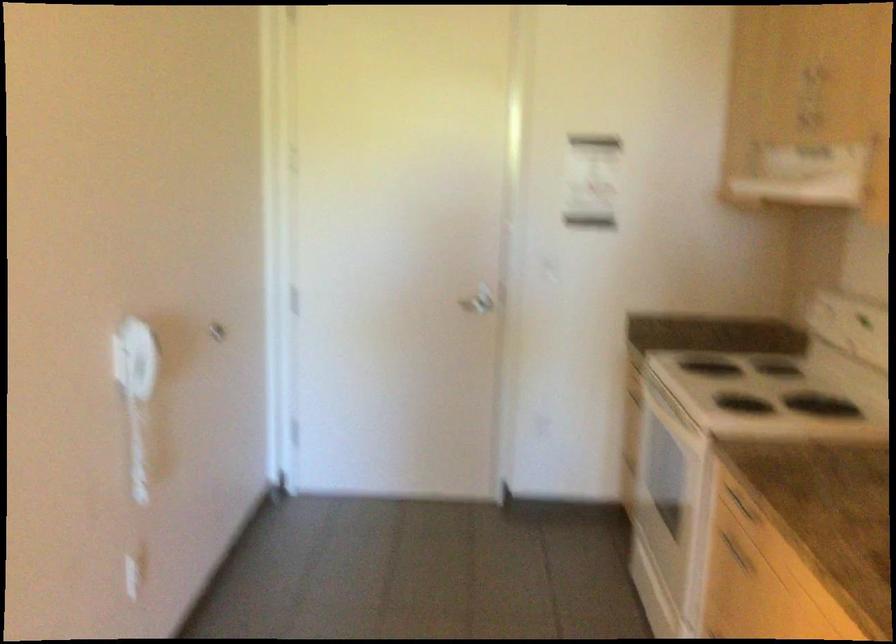
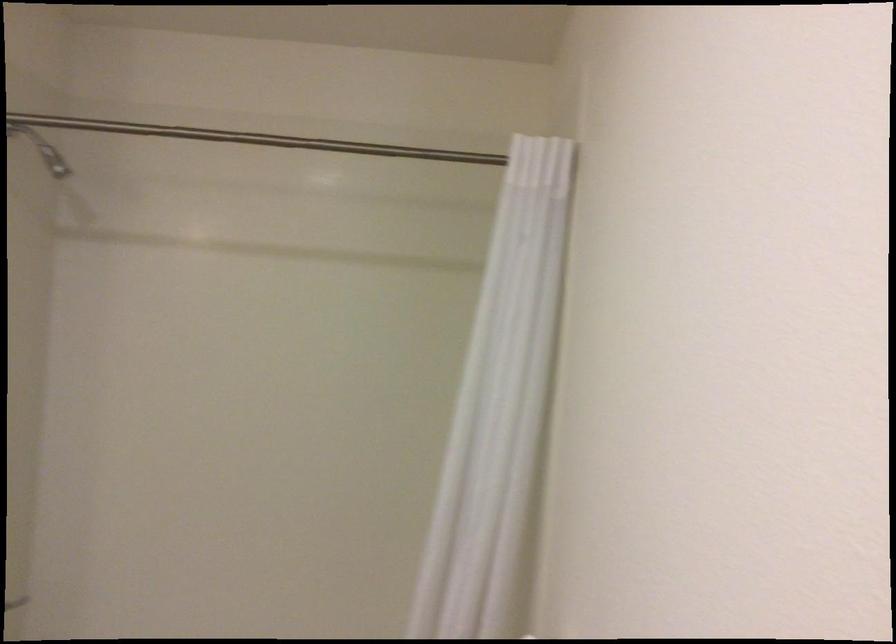
In a continuous first-person perspective shot, in which direction is the camera moving?

The movement direction of the cameraman is left, forward.